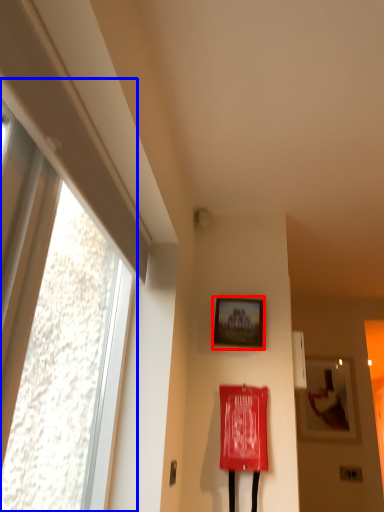
Question: Which of the following is the closest to the observer, picture frame (highlighted by a red box) or window (highlighted by a blue box)?

Choices:
 (A) picture frame
 (B) window

Answer: (B)